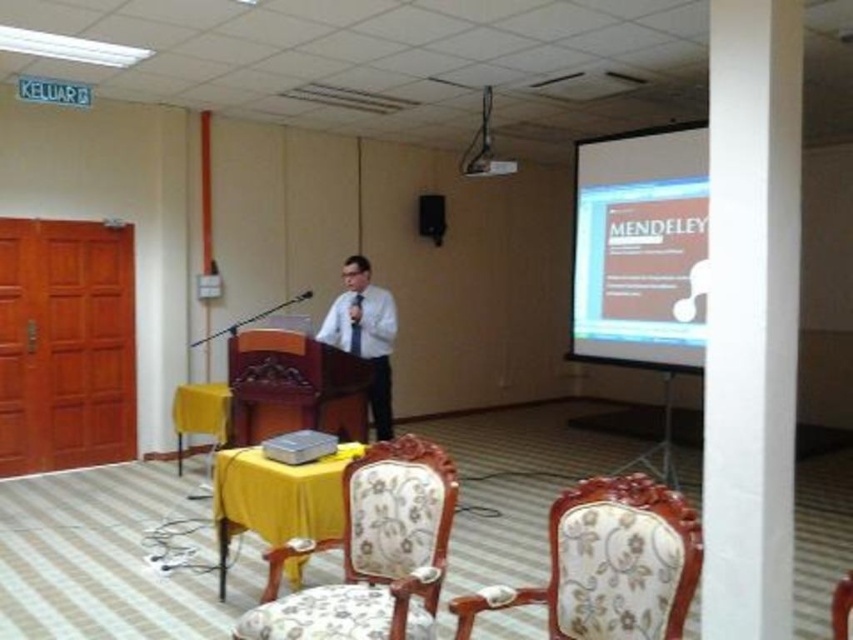
You are an event organizer who needs to set up a 6.5 feet long banner between the white smooth pillar at center right and the white matte projection screen at upper right. Based on the scene, will the banner fit between them?

The distance between the white smooth pillar at center right and the white matte projection screen at upper right is 7.21 feet, which is longer than the 6.5 feet banner, so the banner will fit.

You are an event planner arranging chairs for an audience in the conference room. You need to place the floral fabric armchair at lower center so that it is not blocked by the white smooth pillar at center right. Where should you position it relative to the pillar?

The white smooth pillar at center right is above the floral fabric armchair at lower center, so to avoid blocking it, position the floral fabric armchair at lower center below the pillar.